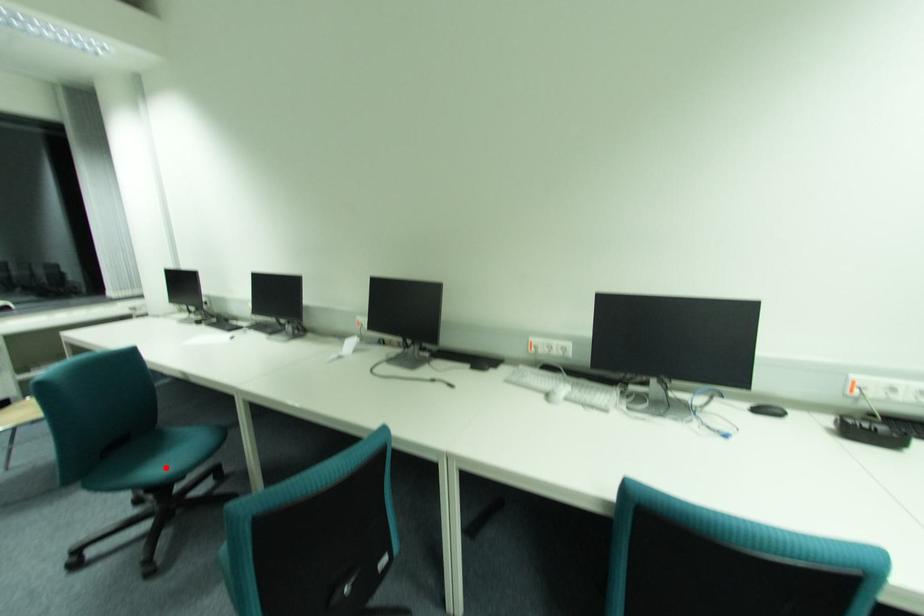
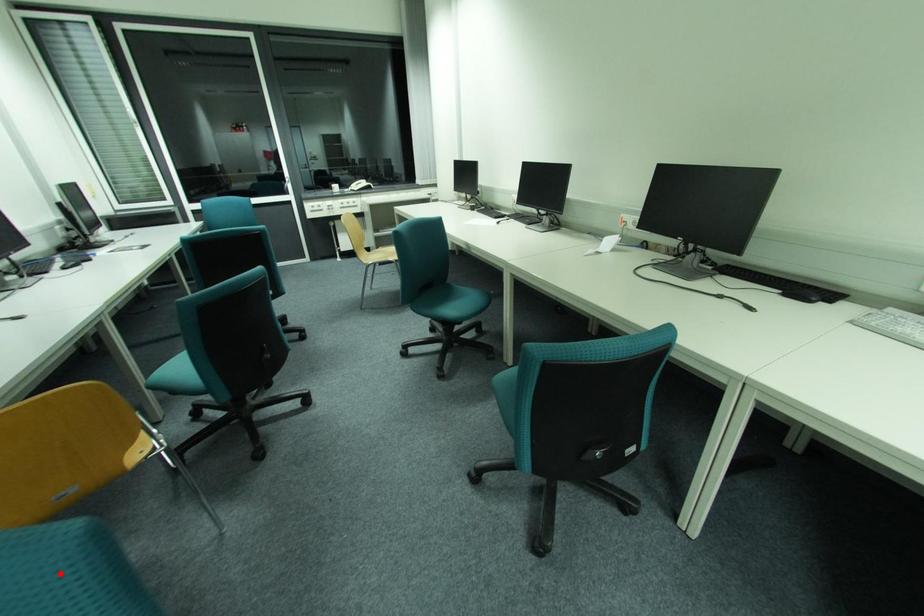
I am providing you with two images of the same scene from different viewpoints. A red point is marked on the first image and another point is marked on the second image. Is the marked point in image1 the same physical position as the marked point in image2?

No